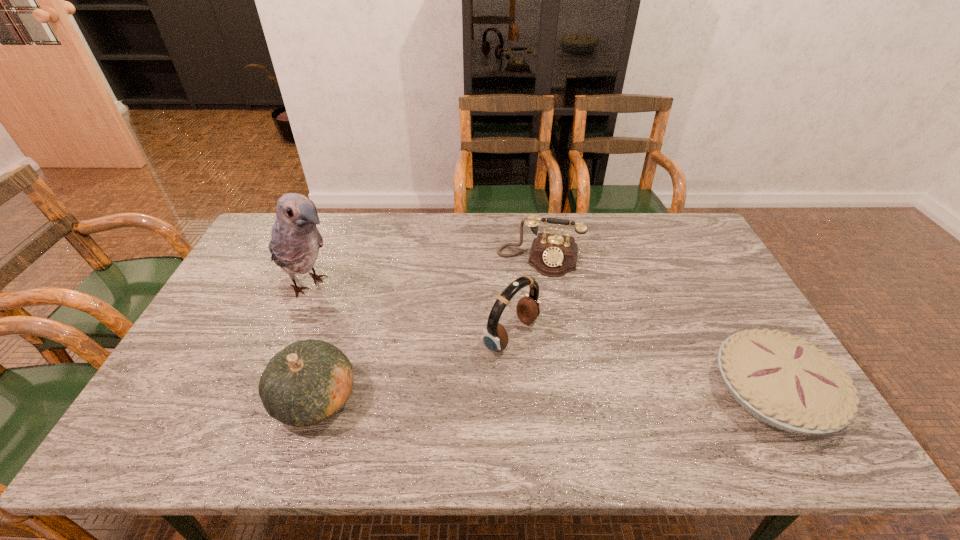
Locate an element on the screen. The width and height of the screenshot is (960, 540). vacant position in the image that satisfies the following two spatial constraints: 1. on the back side of the pie; 2. on the right side of the gourd is located at coordinates (318, 392).

Where is `blank area in the image that satisfies the following two spatial constraints: 1. on the back side of the telephone; 2. on the left side of the headset`? This screenshot has height=540, width=960. blank area in the image that satisfies the following two spatial constraints: 1. on the back side of the telephone; 2. on the left side of the headset is located at coordinates (506, 259).

Identify the location of vacant space that satisfies the following two spatial constraints: 1. on the front side of the headset; 2. on the left side of the rightmost object. The width and height of the screenshot is (960, 540). (516, 392).

You are a GUI agent. You are given a task and a screenshot of the screen. Output one action in this format:
    pyautogui.click(x=<x>, y=<y>)
    Task: Click on the free space that satisfies the following two spatial constraints: 1. on the front side of the shortest object; 2. on the right side of the parrot
    
    Given the screenshot: What is the action you would take?
    pyautogui.click(x=265, y=392)